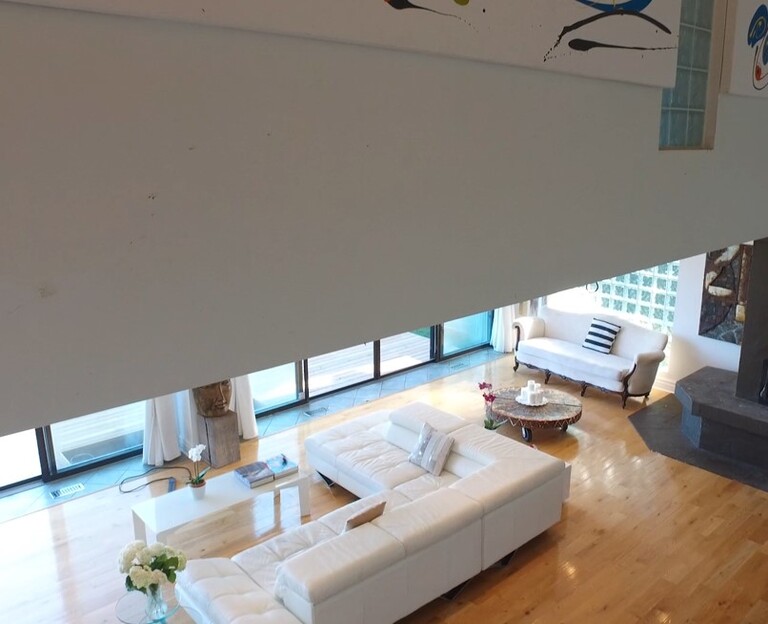
Find the location of `white couch`. white couch is located at coordinates (414, 558), (558, 359).